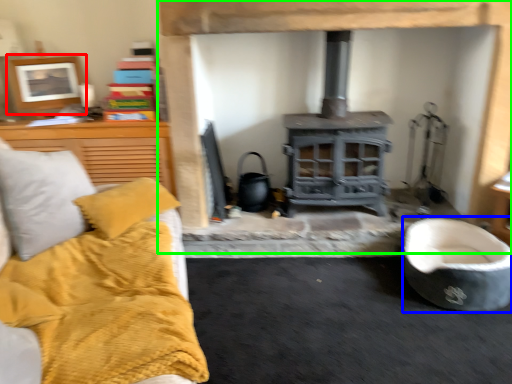
Question: Which object is positioned closest to picture frame (highlighted by a red box)? Select from rocking chair (highlighted by a blue box) and fireplace (highlighted by a green box).

Choices:
 (A) rocking chair
 (B) fireplace

Answer: (B)